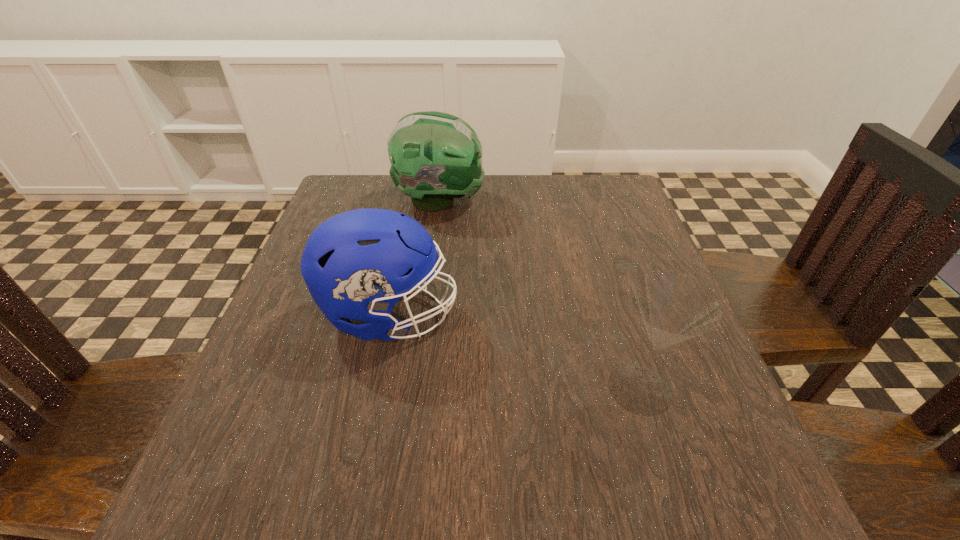
Find the location of a particular element. The width and height of the screenshot is (960, 540). vacant space at the far edge of the desktop is located at coordinates (506, 173).

I want to click on vacant space at the near edge of the desktop, so click(x=350, y=480).

Image resolution: width=960 pixels, height=540 pixels. Find the location of `vacant space at the left edge`. vacant space at the left edge is located at coordinates (231, 424).

This screenshot has height=540, width=960. Identify the location of vacant space at the right edge of the desktop. (661, 363).

In the image, there is a desktop. Find the location of `vacant space at the far left corner`. vacant space at the far left corner is located at coordinates (365, 181).

Locate an element on the screen. This screenshot has height=540, width=960. vacant space at the far right corner of the desktop is located at coordinates (603, 186).

I want to click on unoccupied position between the farther football helmet and the flute glass, so click(x=540, y=295).

This screenshot has width=960, height=540. What are the coordinates of `blank region between the farthest object and the flute glass` in the screenshot? It's located at (540, 295).

Identify the location of free space that is in between the nearest object and the nearer football helmet. The width and height of the screenshot is (960, 540). (515, 352).

Locate an element on the screen. This screenshot has width=960, height=540. vacant area that lies between the flute glass and the farthest object is located at coordinates (540, 295).